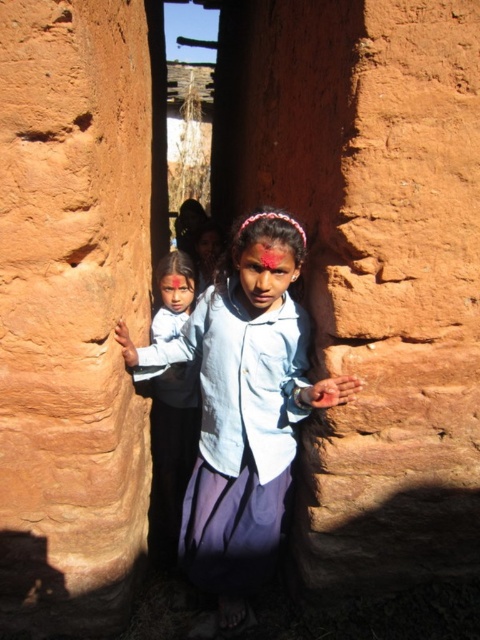
You are a photographer standing in front of the rustic structure and want to take a photo of the two girls wearing blue shirts. Given that your camera has a depth of field that can focus on objects within 24 inches of each other, will both the light blue denim shirt at center and the matte blue shirt at center be in focus?

The distance between the light blue denim shirt at center and the matte blue shirt at center is 27.09 inches. Since the camera can focus on objects within 24 inches of each other, the distance exceeds this limit, so both shirts will not be in focus.

You are a painter standing in front of the matte clay wall at center and the light blue denim shirt at center. You want to paint a mural that covers the entire height of the taller object. Which object should you choose to paint?

The matte clay wall at center is taller than the light blue denim shirt at center, so you should choose to paint the matte clay wall at center to cover its entire height.

You are standing in front of the rustic earthen structure and notice two points marked in the scene. Which point, point (61, 536) or point (192, 397), is nearer to your current position?

Point (61, 536) is closer to the camera than point (192, 397), so it is nearer to your current position.